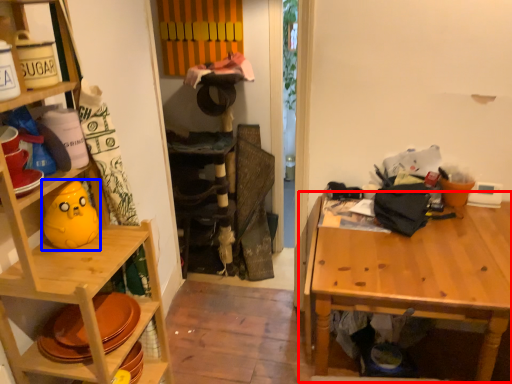
Question: Among these objects, which one is farthest to the camera, table (highlighted by a red box) or toy (highlighted by a blue box)?

Choices:
 (A) table
 (B) toy

Answer: (A)